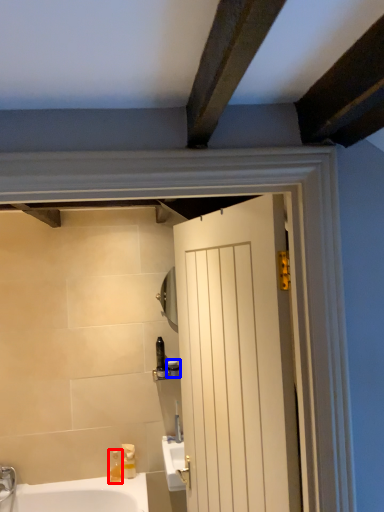
Question: Which of the following is the farthest to the observer, soap dispenser (highlighted by a red box) or toiletry (highlighted by a blue box)?

Choices:
 (A) soap dispenser
 (B) toiletry

Answer: (B)